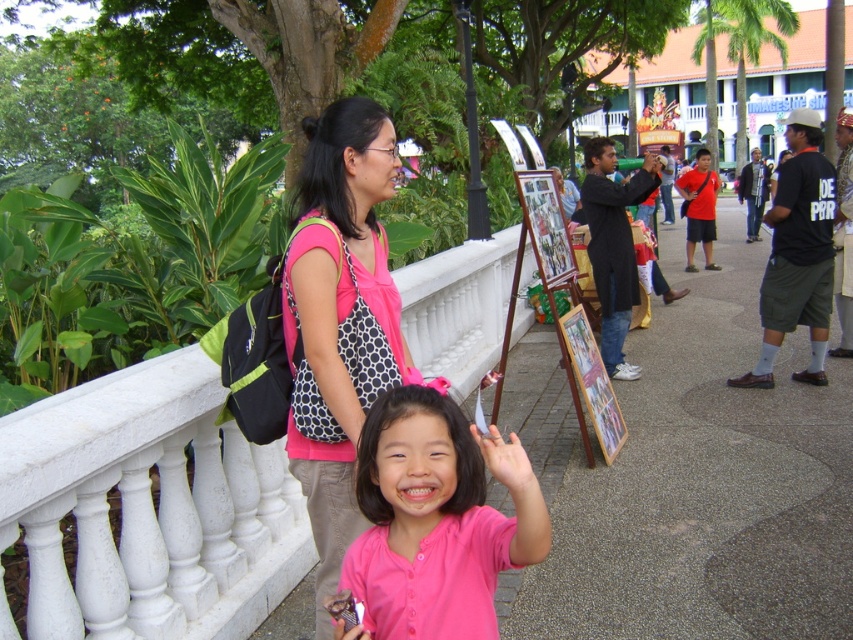
You are a photographer at the park and want to capture a photo that includes both the pink fabric bag at center and the pink matte shirt at center. Which object should you focus on first to ensure both are in frame?

The pink fabric bag at center is larger in size than the pink matte shirt at center, so you should focus on the pink fabric bag at center first to ensure both are in frame.